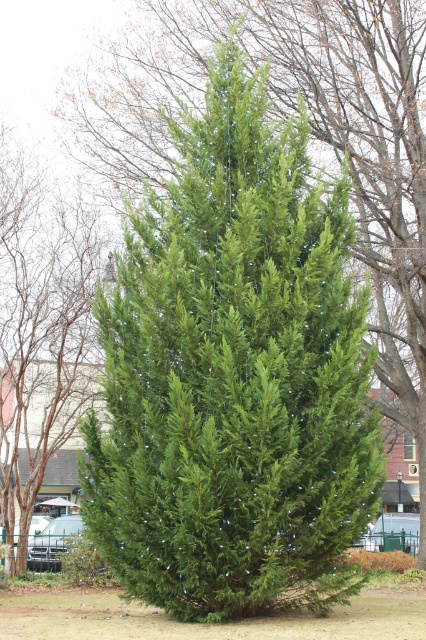
Does green matte fir tree at center have a larger size compared to green matte evergreen tree at center?

Indeed, green matte fir tree at center has a larger size compared to green matte evergreen tree at center.

Consider the image. Does green matte fir tree at center lie in front of green matte evergreen tree at center?

Yes, it is.

Locate an element on the screen. This screenshot has height=640, width=426. green matte fir tree at center is located at coordinates (233, 374).